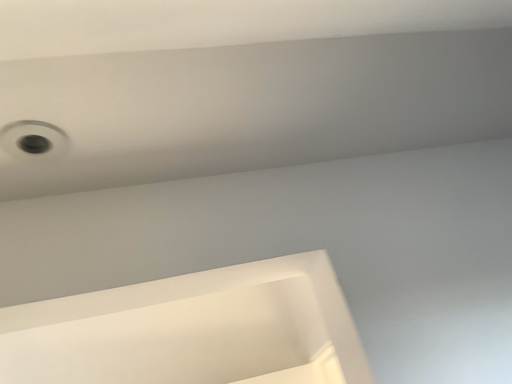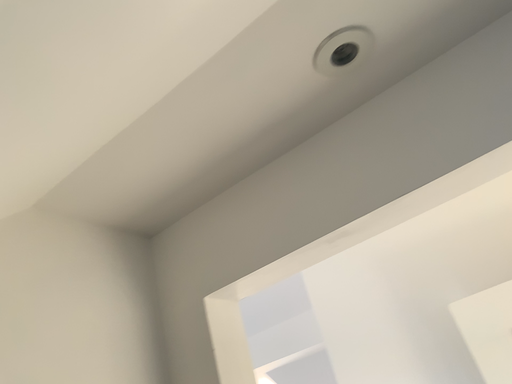
Question: Which way did the camera rotate in the video?

Choices:
 (A) rotated upward
 (B) rotated downward

Answer: (B)